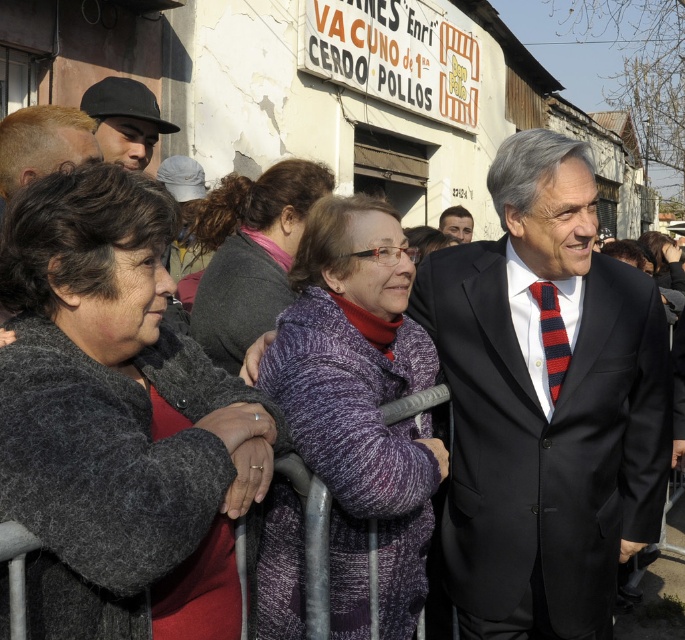
Based on the scene description, which object is taller between the dark gray sweater at center and the black matte hat at upper left?

The dark gray sweater at center is much taller than the black matte hat at upper left according to the description.

You are a photographer at a political event. You need to capture a photo of the black suit at right without including the woman in the purple textured coat. Where should you position yourself relative to the point marked at coordinates (545, 404)?

Position yourself to the left of the point marked at coordinates (545, 404) to ensure the black suit at right is visible while avoiding the woman in the purple textured coat.